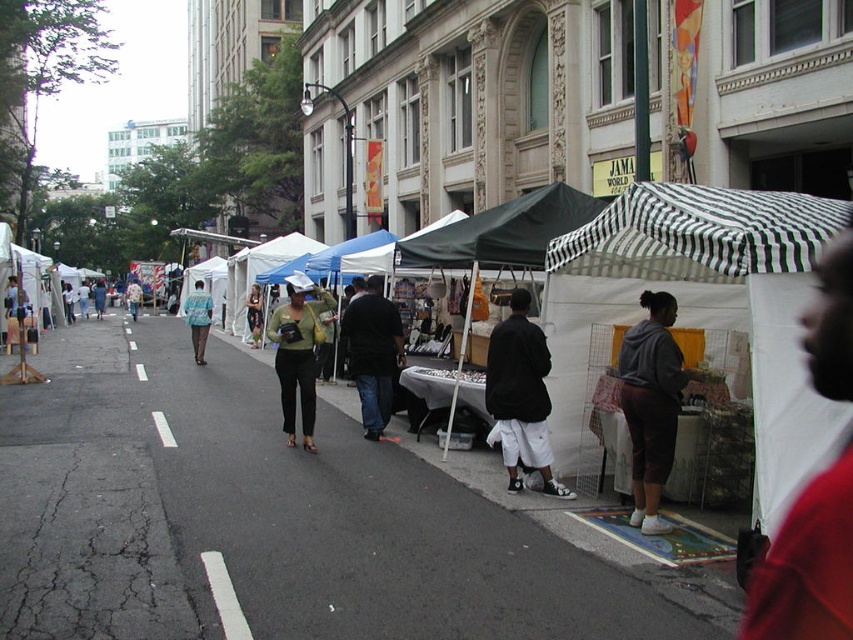
Which is more to the right, black cotton pants at lower center or dark blue jeans at center?

black cotton pants at lower center

Does black cotton pants at lower center appear under dark blue jeans at center?

Indeed, black cotton pants at lower center is positioned under dark blue jeans at center.

Locate an element on the screen. The height and width of the screenshot is (640, 853). black cotton pants at lower center is located at coordinates (521, 396).

Can you confirm if matte green blouse at center is positioned below matte blue shirt at center?

Indeed, matte green blouse at center is positioned under matte blue shirt at center.

Does matte green blouse at center have a larger size compared to matte blue shirt at center?

No.

Between point (292, 422) and point (195, 336), which one is positioned in front?

Positioned in front is point (292, 422).

The height and width of the screenshot is (640, 853). In order to click on matte green blouse at center in this screenshot , I will do `click(299, 353)`.

Which is below, dark gray hoodie at center or green fabric purse at center?

Positioned lower is dark gray hoodie at center.

Between point (645, 472) and point (256, 332), which one is positioned in front?

Point (645, 472) is more forward.

Who is more forward, (630, 385) or (248, 312)?

Point (630, 385)

Identify the location of dark gray hoodie at center. (650, 404).